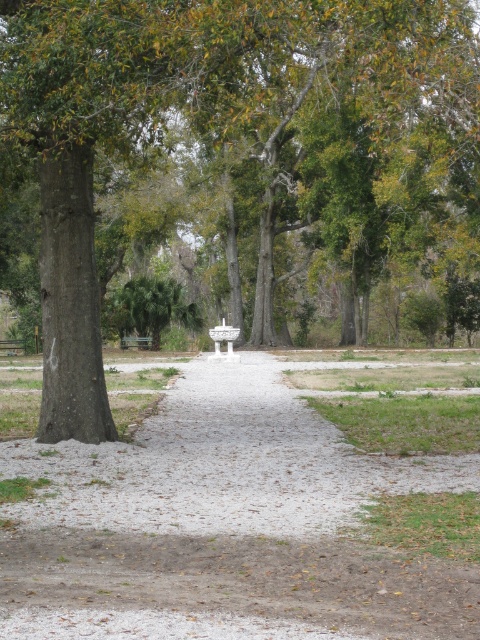
You are standing at the entrance of the park and want to reach the gray gravel path at center. According to the map, the path is marked at coordinates 0.820, 0.465. Which direction should you walk to reach it?

The gray gravel path at center is located at point (223, 524), so you should walk towards the center of the image to reach it.